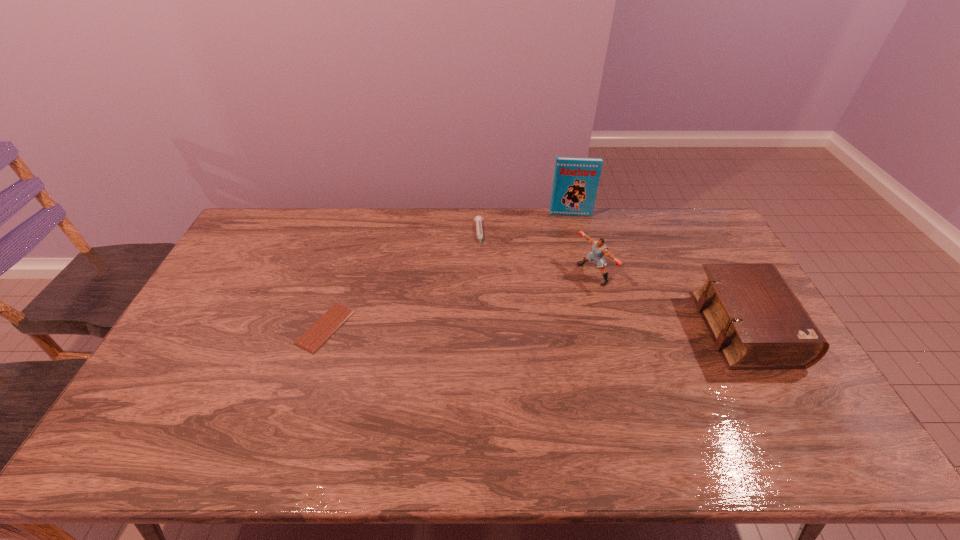
Image resolution: width=960 pixels, height=540 pixels. Identify the location of free space on the desktop that is between the chocolate bar and the Bible and is positioned on the front-facing side of the third nearest object. pyautogui.click(x=482, y=328).

This screenshot has width=960, height=540. I want to click on vacant space on the desktop that is between the leftmost object and the rightmost object and is positioned at the needle end of the second shortest object, so click(x=487, y=328).

This screenshot has width=960, height=540. What are the coordinates of `vacant space on the desktop that is between the leftmost object and the Bible and is positioned on the front cover of the book` in the screenshot? It's located at (585, 328).